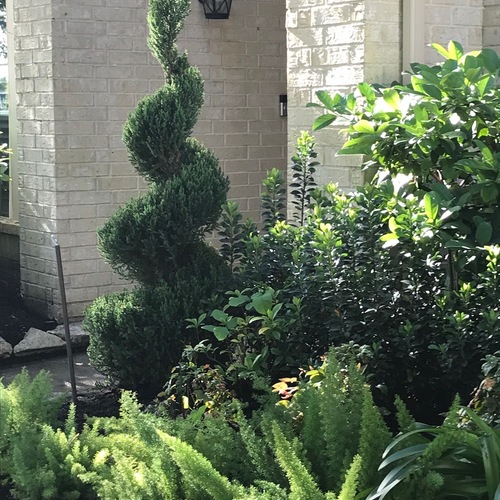
You are a GUI agent. You are given a task and a screenshot of the screen. Output one action in this format:
    pyautogui.click(x=<x>, y=<y>)
    Task: Click on the white brick
    
    Given the screenshot: What is the action you would take?
    pyautogui.click(x=83, y=224)